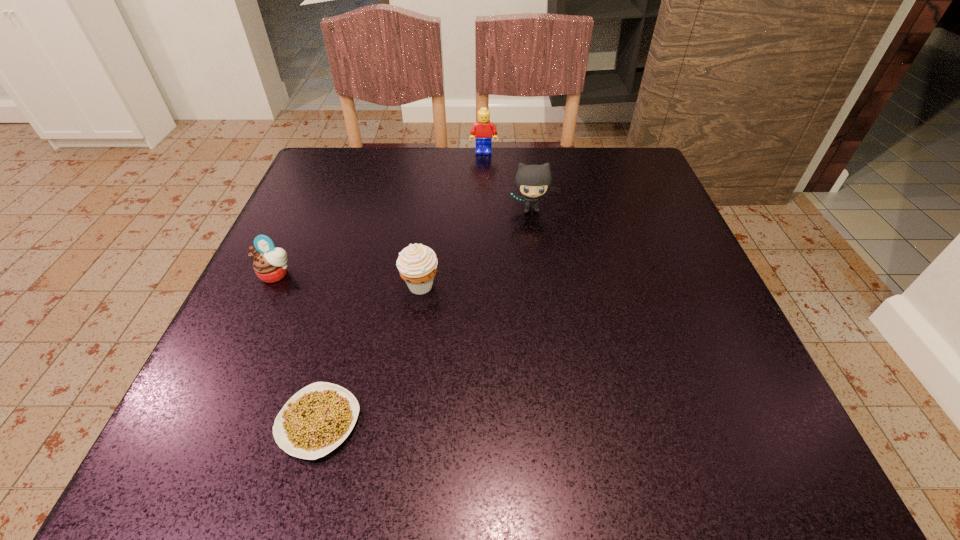
Where is `object that is positioned at the near left corner`? object that is positioned at the near left corner is located at coordinates (317, 419).

Find the location of a particular element. This screenshot has height=540, width=960. free region at the far edge of the desktop is located at coordinates (454, 147).

Locate an element on the screen. The width and height of the screenshot is (960, 540). vacant space at the near edge of the desktop is located at coordinates (448, 415).

In the image, there is a desktop. What are the coordinates of `blank space at the left edge` in the screenshot? It's located at (211, 395).

In the image, there is a desktop. Identify the location of vacant area at the right edge. (666, 231).

In the image, there is a desktop. Identify the location of free space at the far left corner. (354, 177).

You are a GUI agent. You are given a task and a screenshot of the screen. Output one action in this format:
    pyautogui.click(x=<x>, y=<y>)
    Task: Click on the vacant space at the far right corner of the desktop
    
    Given the screenshot: What is the action you would take?
    pyautogui.click(x=588, y=164)

The height and width of the screenshot is (540, 960). What are the coordinates of `free space at the near right corner of the desktop` in the screenshot? It's located at (687, 423).

Where is `vacant space in between the Lego and the third object from left to right`? The width and height of the screenshot is (960, 540). vacant space in between the Lego and the third object from left to right is located at coordinates (452, 219).

Where is `empty space that is in between the shorter muffin and the shortest object`? The image size is (960, 540). empty space that is in between the shorter muffin and the shortest object is located at coordinates (298, 348).